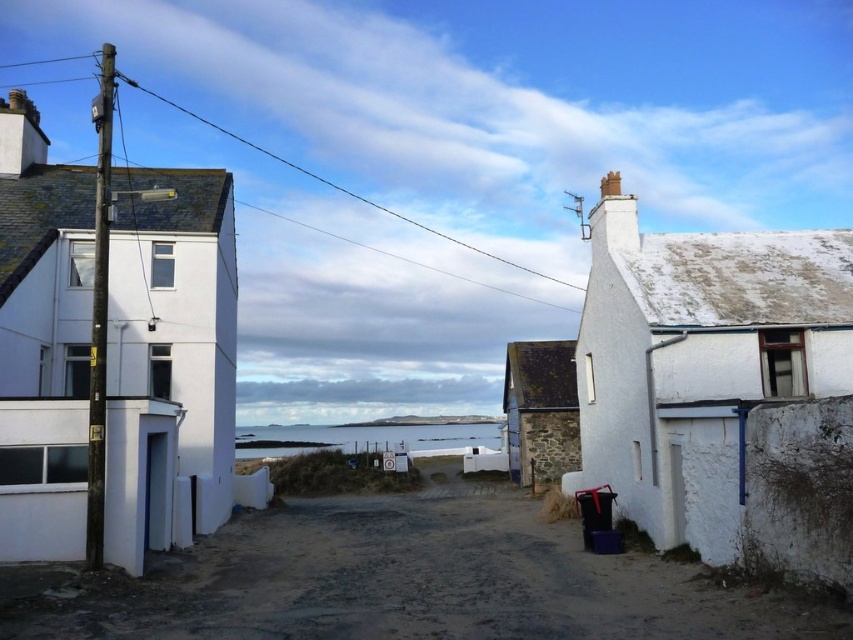
Does white matte house at left come behind white rough stone cottage at right?

Yes, white matte house at left is behind white rough stone cottage at right.

Between point (173, 253) and point (811, 269), which one is positioned behind?

The point (173, 253) is more distant.

Where is `white matte house at left`? white matte house at left is located at coordinates (167, 355).

Does point (419, 515) come in front of point (589, 240)?

That is False.

Is dirt ground at center smaller than white rough stone cottage at right?

Yes.

The image size is (853, 640). Describe the element at coordinates (404, 580) in the screenshot. I see `dirt ground at center` at that location.

Find the location of a particular element. This screenshot has width=853, height=640. dirt ground at center is located at coordinates (404, 580).

Can you confirm if white matte house at left is taller than rustic stone cottage at center?

Correct, white matte house at left is much taller as rustic stone cottage at center.

Does white matte house at left appear on the right side of rustic stone cottage at center?

In fact, white matte house at left is to the left of rustic stone cottage at center.

The height and width of the screenshot is (640, 853). What do you see at coordinates (167, 355) in the screenshot?
I see `white matte house at left` at bounding box center [167, 355].

Locate an element on the screen. The width and height of the screenshot is (853, 640). white matte house at left is located at coordinates (167, 355).